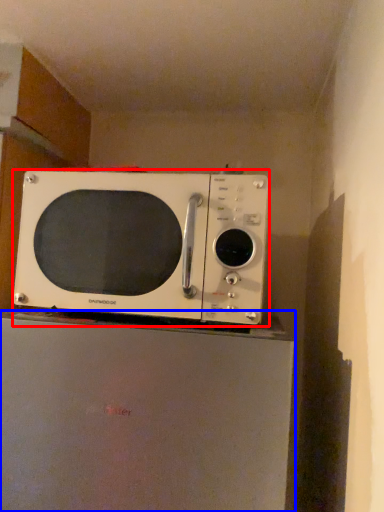
Question: Which object is closer to the camera taking this photo, microwave oven (highlighted by a red box) or appliance (highlighted by a blue box)?

Choices:
 (A) microwave oven
 (B) appliance

Answer: (B)